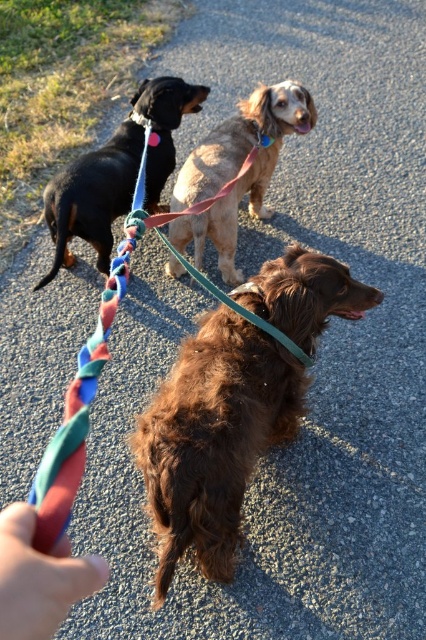
Can you confirm if multicolored braided leash at center is thinner than blue fabric neckband at upper center?

No.

Which is below, multicolored braided leash at center or blue fabric neckband at upper center?

Positioned lower is multicolored braided leash at center.

The height and width of the screenshot is (640, 426). What are the coordinates of `multicolored braided leash at center` in the screenshot? It's located at (103, 364).

Where is `multicolored braided leash at center`? multicolored braided leash at center is located at coordinates (103, 364).

Does point (276, 404) lie behind point (135, 120)?

No, (276, 404) is closer to viewer.

What do you see at coordinates (213, 438) in the screenshot? The height and width of the screenshot is (640, 426). I see `brown furry dog at center` at bounding box center [213, 438].

Is point (176, 556) in front of point (152, 122)?

Yes, it is in front of point (152, 122).

Image resolution: width=426 pixels, height=640 pixels. What are the coordinates of `brown furry dog at center` in the screenshot? It's located at (213, 438).

This screenshot has height=640, width=426. I want to click on brown furry dog at center, so click(213, 438).

Is brown furry dog at center bigger than smooth skin hand at lower left?

Indeed, brown furry dog at center has a larger size compared to smooth skin hand at lower left.

Locate an element on the screen. brown furry dog at center is located at coordinates (213, 438).

You are a GUI agent. You are given a task and a screenshot of the screen. Output one action in this format:
    pyautogui.click(x=<x>, y=<y>)
    Task: Click on the brown furry dog at center
    This screenshot has height=640, width=426.
    Given the screenshot: What is the action you would take?
    pyautogui.click(x=213, y=438)